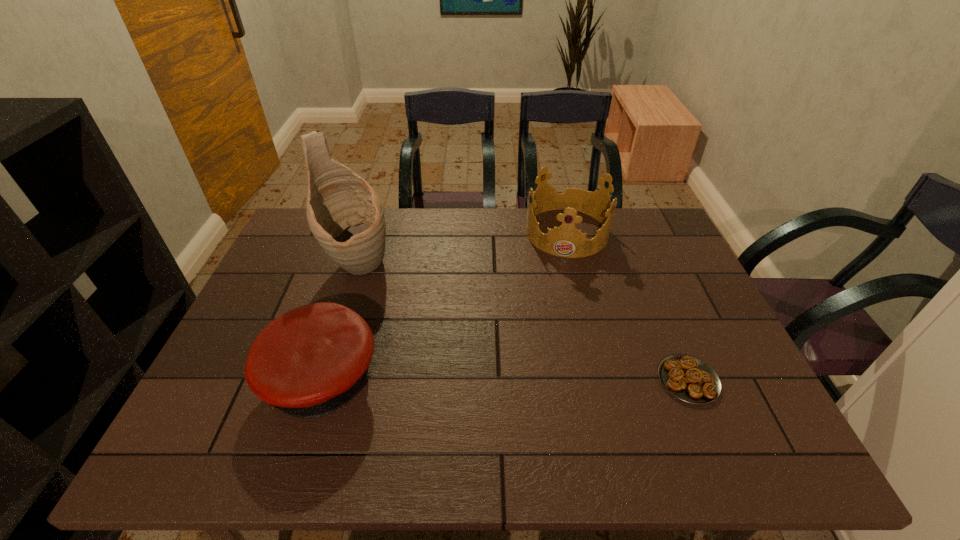
Identify the location of vacant spot on the desktop that is between the third tallest object and the pastry and is positioned at the spout of the pitcher. This screenshot has height=540, width=960. (471, 380).

You are a GUI agent. You are given a task and a screenshot of the screen. Output one action in this format:
    pyautogui.click(x=<x>, y=<y>)
    Task: Click on the vacant spot on the desktop that is between the second shortest object and the pastry and is positioned on the front-facing side of the tiara
    
    Given the screenshot: What is the action you would take?
    pyautogui.click(x=549, y=380)